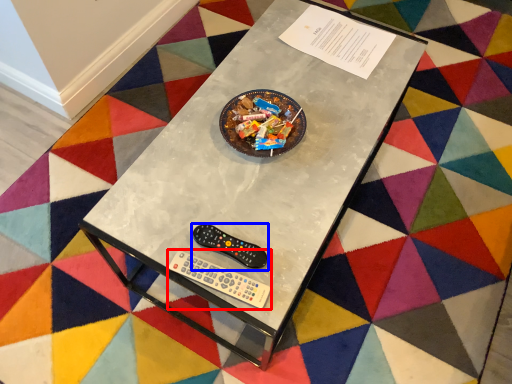
Question: Which of the following is the farthest to the observer, Wii controller (highlighted by a red box) or control (highlighted by a blue box)?

Choices:
 (A) Wii controller
 (B) control

Answer: (B)